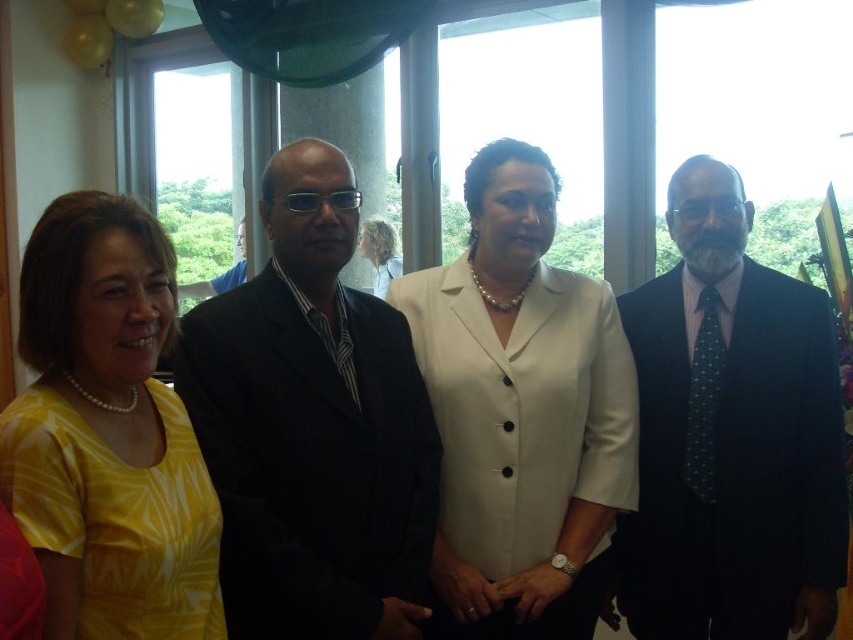
Question: Which of these objects is positioned farthest from the black suit at center?

Choices:
 (A) dark blue suit at right
 (B) white satin blazer at center
 (C) light brown hair at center
 (D) yellow printed blouse at center

Answer: (C)

Question: Does white satin blazer at center have a larger size compared to light brown hair at center?

Choices:
 (A) yes
 (B) no

Answer: (A)

Question: Does black suit at center appear over light brown hair at center?

Choices:
 (A) yes
 (B) no

Answer: (B)

Question: Which point is closer to the camera?

Choices:
 (A) light brown hair at center
 (B) white satin blazer at center

Answer: (B)

Question: Can you confirm if yellow printed blouse at center is thinner than light brown hair at center?

Choices:
 (A) yes
 (B) no

Answer: (B)

Question: Which point is closer to the camera?

Choices:
 (A) light brown hair at center
 (B) yellow printed blouse at center
 (C) dark blue suit at right

Answer: (B)